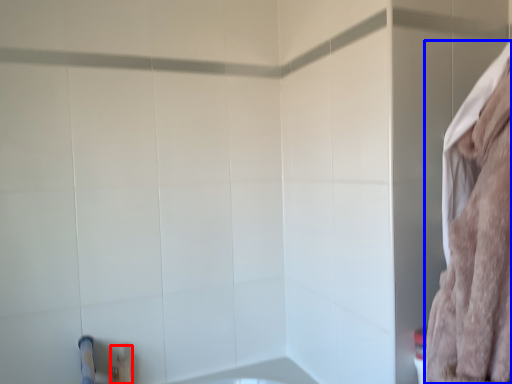
Question: Among these objects, which one is nearest to the camera, toiletry (highlighted by a red box) or bath towel (highlighted by a blue box)?

Choices:
 (A) toiletry
 (B) bath towel

Answer: (B)